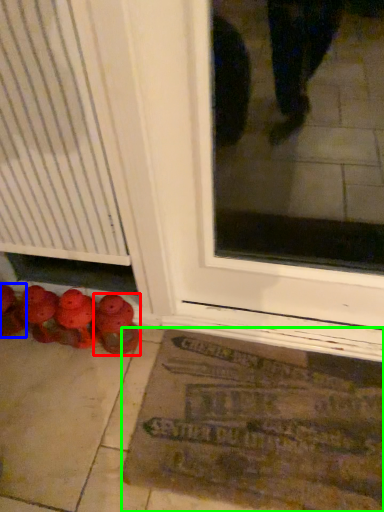
Question: Which is nearer to the footwear (highlighted by a red box)? footwear (highlighted by a blue box) or bath mat (highlighted by a green box).

Choices:
 (A) footwear
 (B) bath mat

Answer: (A)